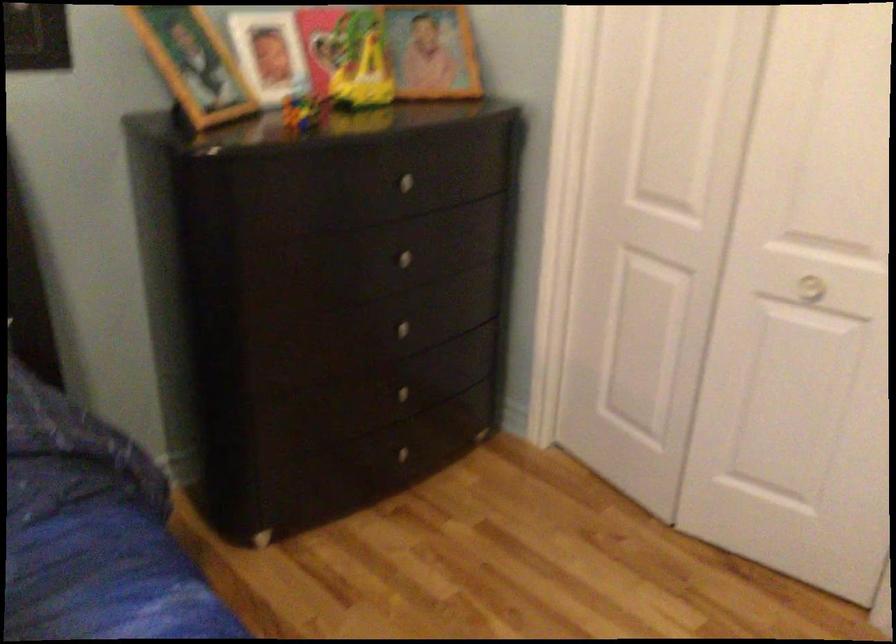
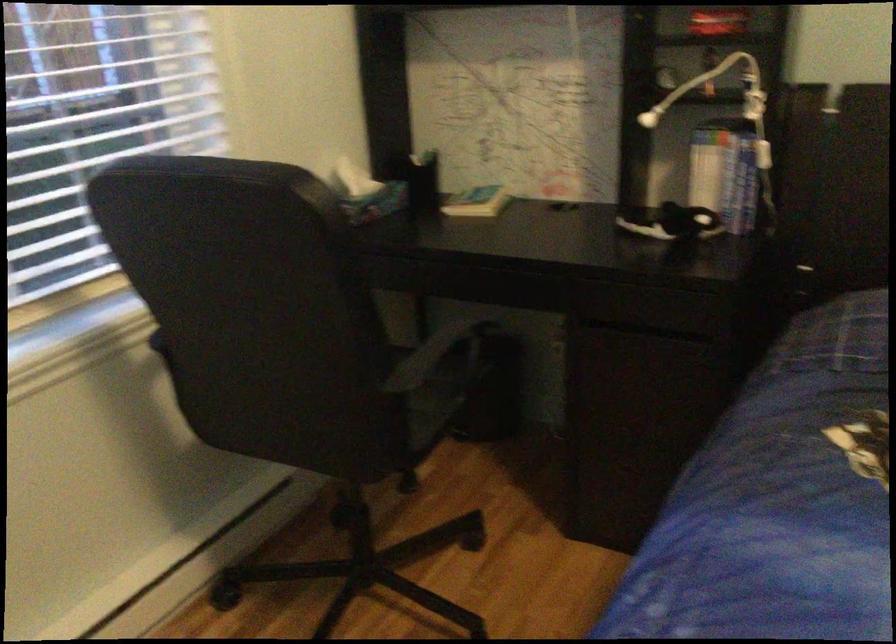
Question: The camera is either moving clockwise (left) or counter-clockwise (right) around the object. The first image is from the beginning of the video and the second image is from the end. Is the camera moving left or right when shooting the video?

Choices:
 (A) Left
 (B) Right

Answer: (B)